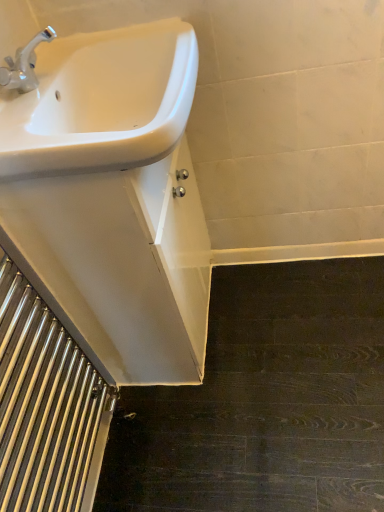
Where is `white glossy sink at upper left`? This screenshot has height=512, width=384. white glossy sink at upper left is located at coordinates (101, 101).

The image size is (384, 512). Describe the element at coordinates (101, 101) in the screenshot. I see `white glossy sink at upper left` at that location.

I want to click on polished stainless steel stairwell at lower left, so click(46, 407).

This screenshot has width=384, height=512. Describe the element at coordinates (46, 407) in the screenshot. I see `polished stainless steel stairwell at lower left` at that location.

The height and width of the screenshot is (512, 384). I want to click on white glossy sink at upper left, so click(x=101, y=101).

Considering the relative positions of white glossy sink at upper left and polished stainless steel stairwell at lower left in the image provided, is white glossy sink at upper left to the left or to the right of polished stainless steel stairwell at lower left?

In the image, white glossy sink at upper left appears on the right side of polished stainless steel stairwell at lower left.

Between white glossy sink at upper left and polished stainless steel stairwell at lower left, which one is positioned in front?

polished stainless steel stairwell at lower left is more forward.

Between point (50, 147) and point (49, 401), which one is positioned behind?

Positioned behind is point (49, 401).

Based on the photo, from the image's perspective, relative to polished stainless steel stairwell at lower left, is white glossy sink at upper left above or below?

white glossy sink at upper left is situated higher than polished stainless steel stairwell at lower left in the image.

From a real-world perspective, which object stands above the other?

white glossy sink at upper left is physically above.

Which object is wider, white glossy sink at upper left or polished stainless steel stairwell at lower left?

With larger width is white glossy sink at upper left.

Considering the sizes of white glossy sink at upper left and polished stainless steel stairwell at lower left in the image, is white glossy sink at upper left taller or shorter than polished stainless steel stairwell at lower left?

In the image, white glossy sink at upper left appears to be shorter than polished stainless steel stairwell at lower left.

Who is smaller, white glossy sink at upper left or polished stainless steel stairwell at lower left?

polished stainless steel stairwell at lower left.

Is polished stainless steel stairwell at lower left located within white glossy sink at upper left?

Definitely not — polished stainless steel stairwell at lower left is not inside white glossy sink at upper left.

Can you see white glossy sink at upper left touching polished stainless steel stairwell at lower left?

white glossy sink at upper left is not next to polished stainless steel stairwell at lower left, and they're not touching.

Is white glossy sink at upper left positioned with its back to polished stainless steel stairwell at lower left?

That's not correct — white glossy sink at upper left is not looking away from polished stainless steel stairwell at lower left.

How many degrees apart are the facing directions of white glossy sink at upper left and polished stainless steel stairwell at lower left?

The angle between the facing direction of white glossy sink at upper left and the facing direction of polished stainless steel stairwell at lower left is 0.785 degrees.

Locate an element on the screen. This screenshot has height=512, width=384. sink behind the polished stainless steel stairwell at lower left is located at coordinates [x=101, y=101].

Which object is positioned more to the left, polished stainless steel stairwell at lower left or white glossy sink at upper left?

polished stainless steel stairwell at lower left.

Is the position of polished stainless steel stairwell at lower left less distant than that of white glossy sink at upper left?

Yes, it is.

Considering the points (38, 482) and (43, 115), which point is in front, point (38, 482) or point (43, 115)?

The point (38, 482) is in front.

From the image's perspective, would you say polished stainless steel stairwell at lower left is shown under white glossy sink at upper left?

Indeed, from the image's perspective, polished stainless steel stairwell at lower left is shown beneath white glossy sink at upper left.

From a real-world perspective, is polished stainless steel stairwell at lower left positioned above or below white glossy sink at upper left?

polished stainless steel stairwell at lower left is below white glossy sink at upper left.

Which of these two, polished stainless steel stairwell at lower left or white glossy sink at upper left, is thinner?

Thinner between the two is polished stainless steel stairwell at lower left.

Is polished stainless steel stairwell at lower left shorter than white glossy sink at upper left?

Incorrect, the height of polished stainless steel stairwell at lower left does not fall short of that of white glossy sink at upper left.

From the picture: Between polished stainless steel stairwell at lower left and white glossy sink at upper left, which one has larger size?

white glossy sink at upper left is bigger.

Is white glossy sink at upper left completely or partially inside polished stainless steel stairwell at lower left?

No, polished stainless steel stairwell at lower left does not contain white glossy sink at upper left.

Is polished stainless steel stairwell at lower left not close to white glossy sink at upper left?

No.

Is polished stainless steel stairwell at lower left facing towards white glossy sink at upper left?

No, polished stainless steel stairwell at lower left is not oriented towards white glossy sink at upper left.

Where is `sink above the polished stainless steel stairwell at lower left (from the image's perspective)`? sink above the polished stainless steel stairwell at lower left (from the image's perspective) is located at coordinates (101, 101).

At what (x,y) coordinates should I click in order to perform the action: click on stairwell located below the white glossy sink at upper left (from the image's perspective). Please return your answer as a coordinate pair (x, y). The width and height of the screenshot is (384, 512). Looking at the image, I should click on (46, 407).

The width and height of the screenshot is (384, 512). Identify the location of sink positioned vertically above the polished stainless steel stairwell at lower left (from a real-world perspective). (101, 101).